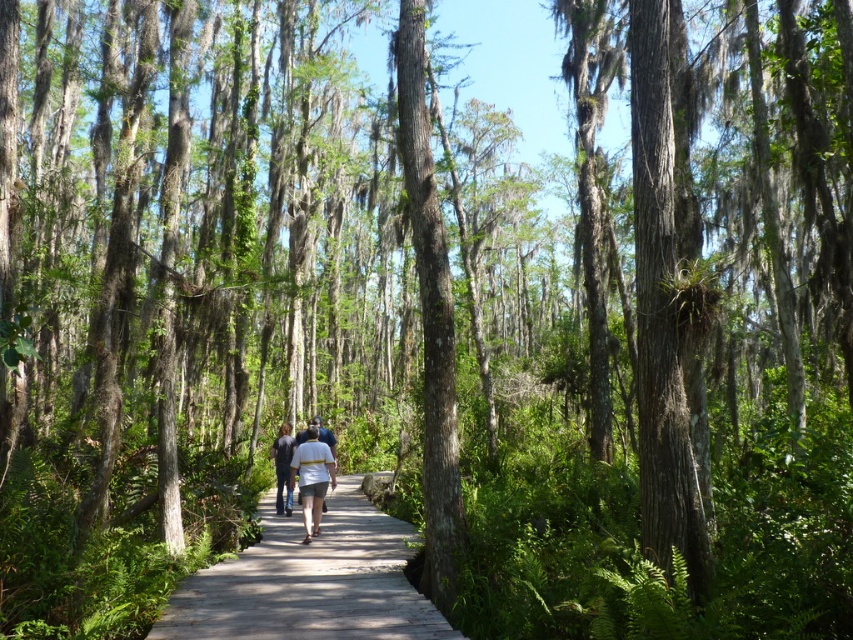
Describe the element at coordinates (312, 474) in the screenshot. This screenshot has width=853, height=640. I see `white cotton shirt at center` at that location.

Is point (332, 486) positioned before point (277, 474)?

Yes, point (332, 486) is closer to viewer.

Is point (316, 497) positioned in front of point (287, 477)?

That is True.

Image resolution: width=853 pixels, height=640 pixels. In order to click on white cotton shirt at center in this screenshot , I will do pos(312,474).

Who is positioned more to the right, smooth bark tree at center or white cotton shirt at center?

smooth bark tree at center is more to the right.

Is smooth bark tree at center shorter than white cotton shirt at center?

Correct, smooth bark tree at center is not as tall as white cotton shirt at center.

Image resolution: width=853 pixels, height=640 pixels. I want to click on smooth bark tree at center, so click(430, 317).

Locate an element on the screen. The width and height of the screenshot is (853, 640). smooth bark tree at center is located at coordinates (430, 317).

Can you confirm if wooden boardwalk at center is bigger than dark blue jeans at center?

Yes, wooden boardwalk at center is bigger than dark blue jeans at center.

Does point (323, 624) come in front of point (280, 428)?

Yes, it is in front of point (280, 428).

The image size is (853, 640). Find the location of `wooden boardwalk at center`. wooden boardwalk at center is located at coordinates (310, 582).